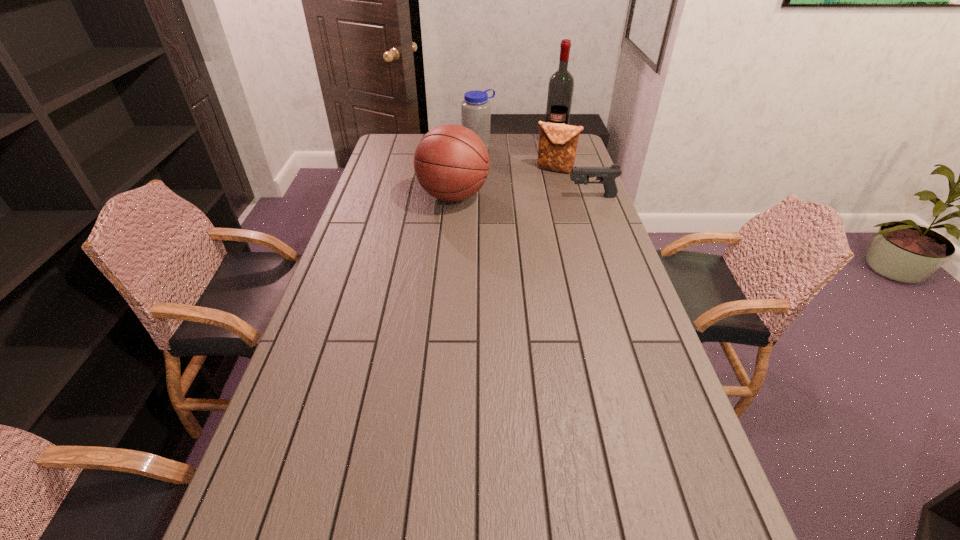
Locate an element on the screen. Image resolution: width=960 pixels, height=540 pixels. basketball is located at coordinates (451, 162).

What are the coordinates of `pistol` in the screenshot? It's located at (607, 175).

You are a GUI agent. You are given a task and a screenshot of the screen. Output one action in this format:
    pyautogui.click(x=<x>, y=<y>)
    Task: Click on the third nearest object
    The width and height of the screenshot is (960, 540).
    Given the screenshot: What is the action you would take?
    tap(557, 148)

Locate an element on the screen. The width and height of the screenshot is (960, 540). the fourth tallest object is located at coordinates (557, 148).

This screenshot has width=960, height=540. Find the location of `alcohol`. alcohol is located at coordinates (561, 84).

Where is `water bottle`? water bottle is located at coordinates (475, 109).

You are a GUI agent. You are given a task and a screenshot of the screen. Output one action in this format:
    pyautogui.click(x=<x>, y=<y>)
    Task: Click on the vacant space located on the back of the basketball
    This screenshot has width=960, height=540.
    Given the screenshot: What is the action you would take?
    pyautogui.click(x=458, y=140)

Locate an element on the screen. The image size is (960, 540). vacant region located 0.170m at the barrel of the pistol is located at coordinates (523, 197).

I want to click on vacant space located at the barrel of the pistol, so click(549, 197).

Locate an element on the screen. blank area located at the barrel of the pistol is located at coordinates (472, 197).